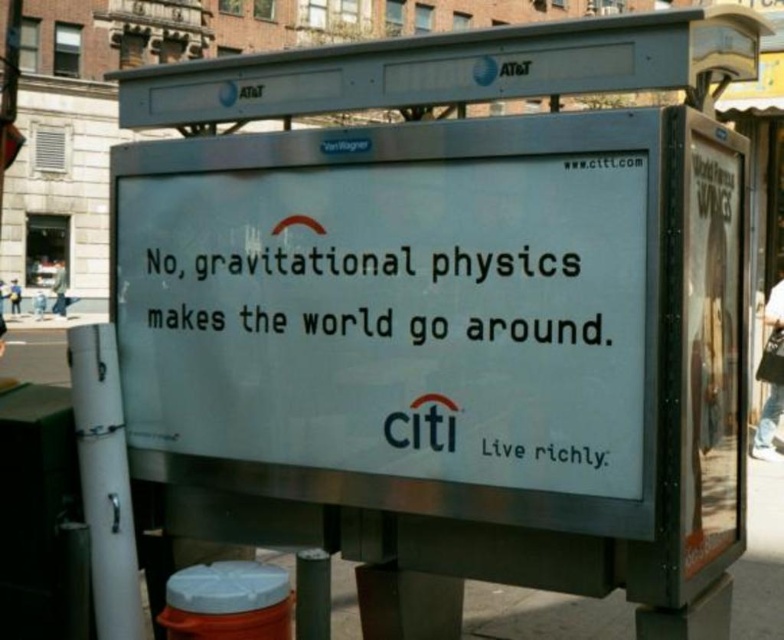
You are a delivery driver who needs to deliver a package to the address shown on the metallic silver street sign at upper center. The GPS says you are currently at point 0.0. Can you estimate how far you need to travel to reach the sign?

The metallic silver street sign at upper center is located at point 0.114, so you need to travel approximately 0.114 units to reach it.

You are a delivery person carrying a box that is 3 meters long. You need to walk under the metallic silver street sign at upper center. Will the box hit the sign?

The metallic silver street sign at upper center is 2.85 meters away from the viewer. Since the box is 3 meters long, it will likely hit the sign when carried under it.

You are a pedestrian looking at the billboard and want to read both the metallic silver street sign at upper center and the black text at center. Which one do you need to look to the left of the other to see?

The metallic silver street sign at upper center is positioned on the left side of black text at center, so to see both, you need to look to the left of the black text at center to see the metallic silver street sign at upper center.